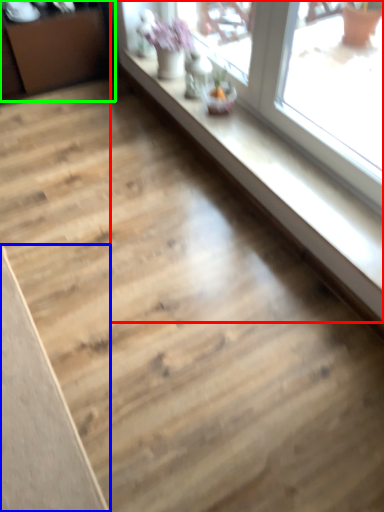
Question: Which object is the closest to the window (highlighted by a red box)? Choose among these: plank (highlighted by a blue box) or dresser (highlighted by a green box).

Choices:
 (A) plank
 (B) dresser

Answer: (B)